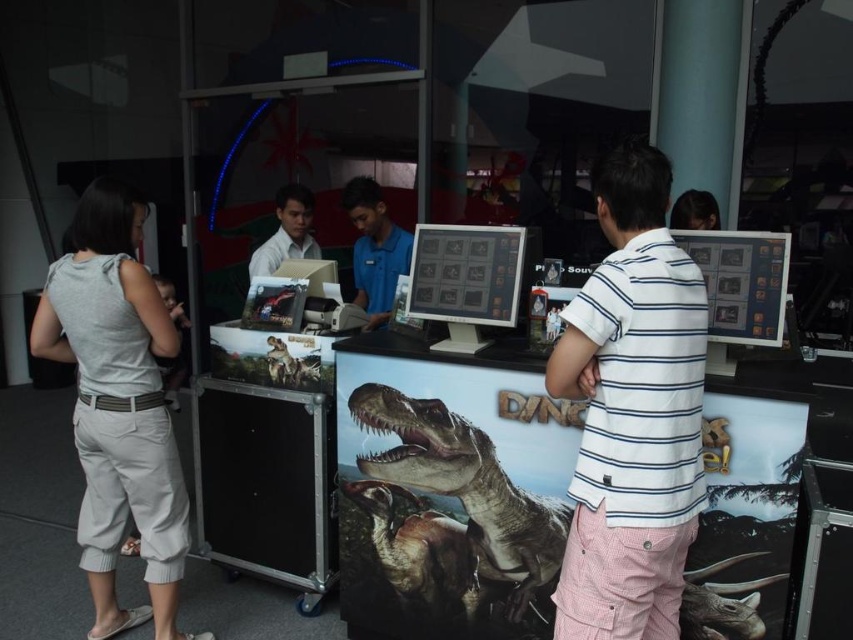
Does point (444, 428) come farther from viewer compared to point (367, 323)?

No, (444, 428) is in front of (367, 323).

Find the location of `shiny metallic dinosaur at center`. shiny metallic dinosaur at center is located at coordinates (463, 481).

Does shiny metallic dinosaur at center appear on the right side of matte white shirt at center?

Correct, you'll find shiny metallic dinosaur at center to the right of matte white shirt at center.

Does point (479, 493) come farther from viewer compared to point (299, 248)?

No.

The image size is (853, 640). Find the location of `shiny metallic dinosaur at center`. shiny metallic dinosaur at center is located at coordinates (463, 481).

Identify the location of shiny metallic dinosaur at center. Image resolution: width=853 pixels, height=640 pixels. (463, 481).

Who is positioned more to the right, white striped shirt at right or gray cotton pants at left?

white striped shirt at right is more to the right.

Does white striped shirt at right have a greater height compared to gray cotton pants at left?

No.

I want to click on white striped shirt at right, so click(631, 412).